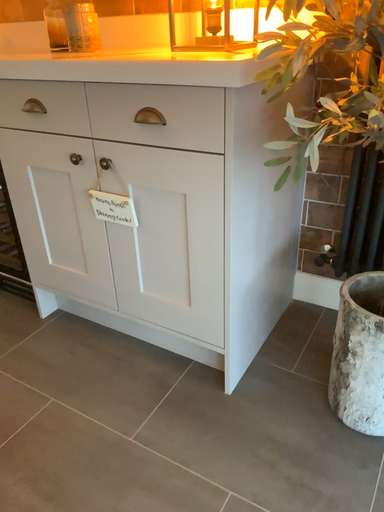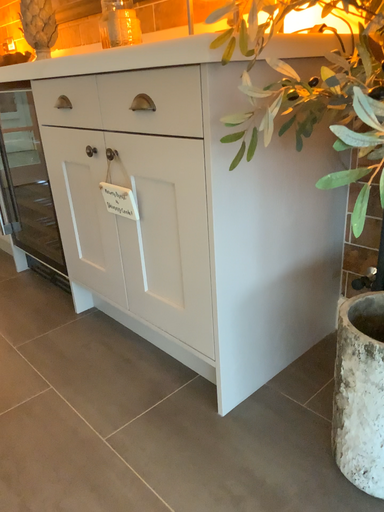
Question: How did the camera likely rotate when shooting the video?

Choices:
 (A) rotated left
 (B) rotated right

Answer: (A)